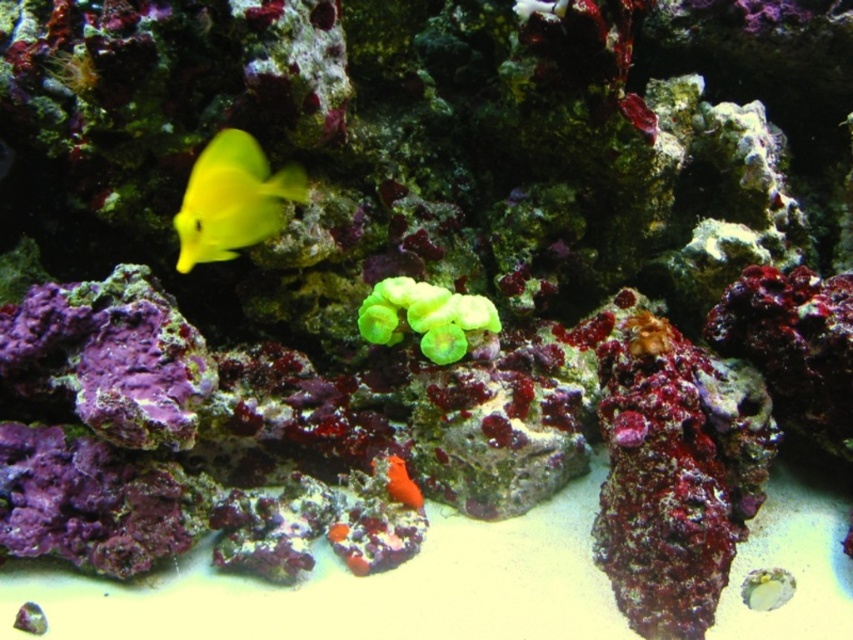
Question: Which object is closer to the camera taking this photo?

Choices:
 (A) green matte coral at center
 (B) yellow matte fish at upper left

Answer: (B)

Question: Which point is closer to the camera?

Choices:
 (A) (412, 497)
 (B) (447, 362)

Answer: (A)

Question: Which object is the farthest from the orange matte sponge at lower center?

Choices:
 (A) green matte coral at center
 (B) yellow matte fish at upper left

Answer: (B)

Question: Does yellow matte fish at upper left have a lesser width compared to orange matte sponge at lower center?

Choices:
 (A) yes
 (B) no

Answer: (B)

Question: Does yellow matte fish at upper left come in front of orange matte sponge at lower center?

Choices:
 (A) yes
 (B) no

Answer: (A)

Question: From the image, what is the correct spatial relationship of yellow matte fish at upper left in relation to green matte coral at center?

Choices:
 (A) above
 (B) below

Answer: (A)